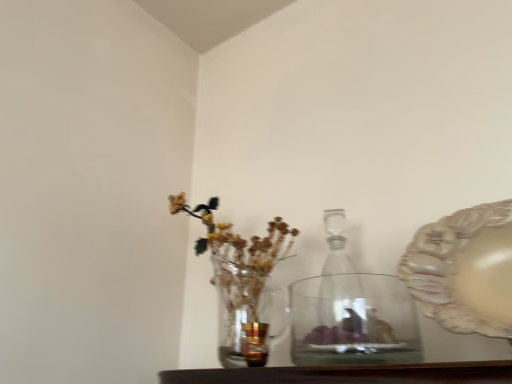
Question: Is transparent glass bottle at center at the right side of matte beige platter at right?

Choices:
 (A) yes
 (B) no

Answer: (B)

Question: Can you confirm if transparent glass bottle at center is shorter than matte beige platter at right?

Choices:
 (A) yes
 (B) no

Answer: (B)

Question: Is transparent glass bottle at center oriented away from matte beige platter at right?

Choices:
 (A) no
 (B) yes

Answer: (A)

Question: Does transparent glass bottle at center touch matte beige platter at right?

Choices:
 (A) yes
 (B) no

Answer: (B)

Question: Is transparent glass bottle at center positioned behind matte beige platter at right?

Choices:
 (A) no
 (B) yes

Answer: (B)

Question: In terms of size, does transparent glass bottle at center appear bigger or smaller than transparent glass vase at center?

Choices:
 (A) big
 (B) small

Answer: (B)

Question: Considering the relative positions of transparent glass bottle at center and transparent glass vase at center in the image provided, is transparent glass bottle at center to the left or to the right of transparent glass vase at center?

Choices:
 (A) right
 (B) left

Answer: (A)

Question: From a real-world perspective, is transparent glass bottle at center above or below transparent glass vase at center?

Choices:
 (A) below
 (B) above

Answer: (B)

Question: Do you think transparent glass bottle at center is within transparent glass vase at center, or outside of it?

Choices:
 (A) inside
 (B) outside

Answer: (B)

Question: From a real-world perspective, is clear glass vase at left physically located above or below gold metallic candle holder at center?

Choices:
 (A) above
 (B) below

Answer: (A)

Question: In terms of size, does clear glass vase at left appear bigger or smaller than gold metallic candle holder at center?

Choices:
 (A) big
 (B) small

Answer: (A)

Question: From the image's perspective, is clear glass vase at left located above or below gold metallic candle holder at center?

Choices:
 (A) below
 (B) above

Answer: (B)

Question: Relative to gold metallic candle holder at center, is clear glass vase at left in front or behind?

Choices:
 (A) front
 (B) behind

Answer: (B)

Question: Visually, is transparent glass vase at center positioned to the left or to the right of transparent glass bottle at center?

Choices:
 (A) left
 (B) right

Answer: (A)

Question: In terms of height, does transparent glass vase at center look taller or shorter compared to transparent glass bottle at center?

Choices:
 (A) tall
 (B) short

Answer: (B)